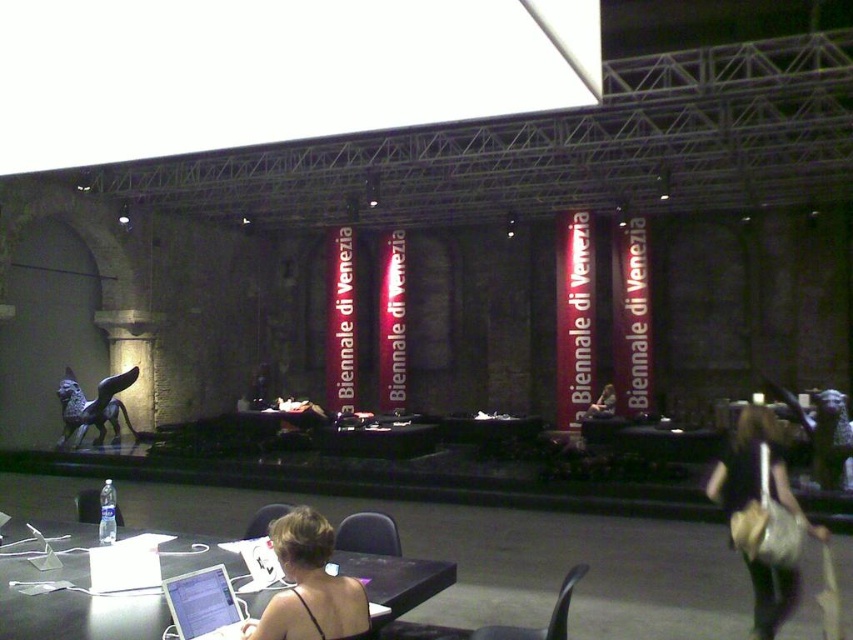
You are organizing a small meeting in this space and need to place the black plastic chair at center and the matte black laptop at center on a table. Considering their sizes, which object should be placed first to ensure they both fit comfortably?

The black plastic chair at center has a smaller size compared to the matte black laptop at center, so you should place the matte black laptop at center first to account for its larger size, then position the black plastic chair at center around it.

You are organizing a workshop and need to place a matte black laptop at center on a table. There is a black plastic chair at lower center already placed. Can the laptop fit on the table next to the chair without overlapping?

The black plastic chair at lower center is narrower than the matte black laptop at center. Since the chair is narrower, there might not be enough space for the laptop to fit next to it without overlapping. However, this depends on the total table width and other items present. The description only mentions the chair is narrower, but doesn